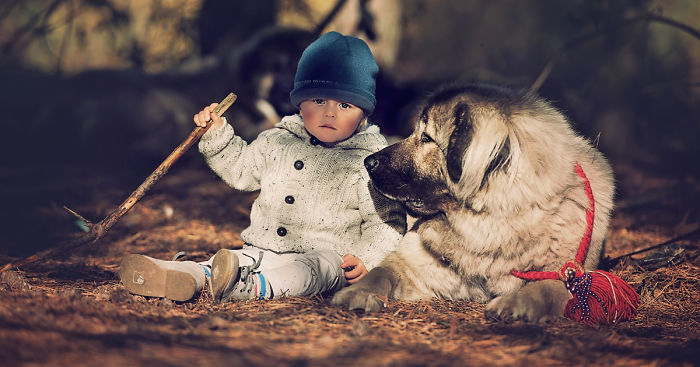
At what (x,y) coordinates should I click in order to perform the action: click on handle. Please return your answer as a coordinate pair (x, y). The image size is (700, 367). Looking at the image, I should click on (138, 194).